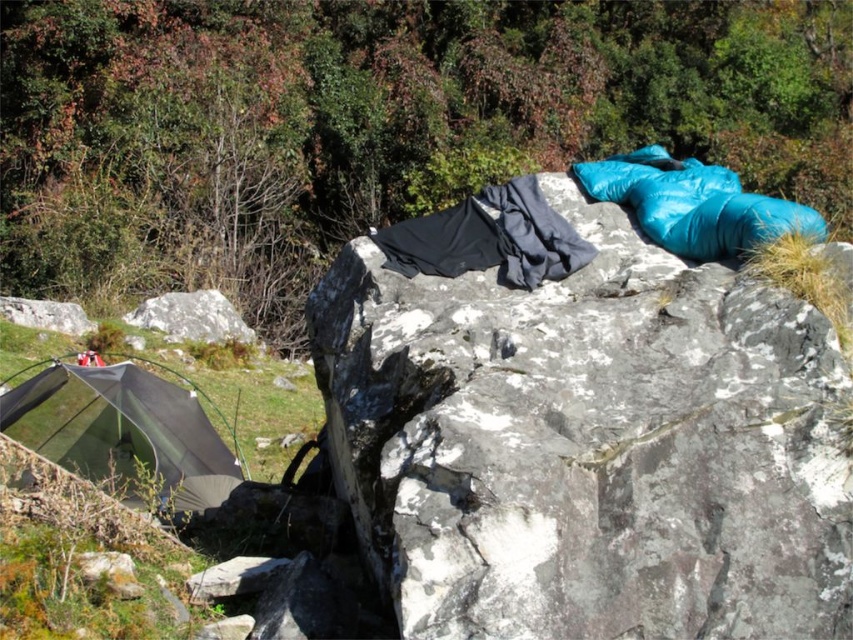
Can you confirm if smooth gray rock at upper center is positioned to the right of matte gray tent at lower left?

Yes, smooth gray rock at upper center is to the right of matte gray tent at lower left.

Who is positioned more to the right, smooth gray rock at upper center or matte gray tent at lower left?

Positioned to the right is smooth gray rock at upper center.

Between point (827, 614) and point (178, 426), which one is positioned behind?

Point (178, 426)

Identify the location of smooth gray rock at upper center. (589, 444).

Who is taller, smooth gray rock at upper center or gray rough rock at lower left?

smooth gray rock at upper center is taller.

Between point (370, 481) and point (219, 301), which one is positioned in front?

Point (370, 481) is in front.

Is point (502, 465) behind point (193, 330)?

No, it is in front of (193, 330).

I want to click on smooth gray rock at upper center, so click(x=589, y=444).

This screenshot has width=853, height=640. Describe the element at coordinates (123, 433) in the screenshot. I see `matte gray tent at lower left` at that location.

Which is behind, point (77, 461) or point (225, 301)?

Positioned behind is point (225, 301).

The width and height of the screenshot is (853, 640). In order to click on matte gray tent at lower left in this screenshot , I will do `click(123, 433)`.